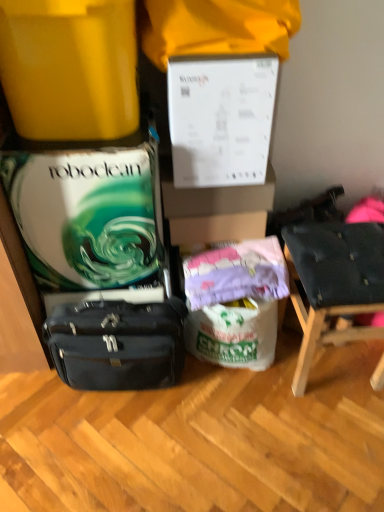
Question: Is matte yellow container at upper left wider or thinner than matte black briefcase at lower left?

Choices:
 (A) wide
 (B) thin

Answer: (A)

Question: From a real-world perspective, is matte yellow container at upper left positioned above or below matte black briefcase at lower left?

Choices:
 (A) below
 (B) above

Answer: (B)

Question: Based on their relative distances, which object is farther from the matte black briefcase at lower left?

Choices:
 (A) matte yellow container at upper left
 (B) purple fabric at center
 (C) dark blue fabric chair at right

Answer: (A)

Question: Estimate the real-world distances between objects in this image. Which object is farther from the matte yellow container at upper left?

Choices:
 (A) purple fabric at center
 (B) dark blue fabric chair at right
 (C) matte black briefcase at lower left

Answer: (B)